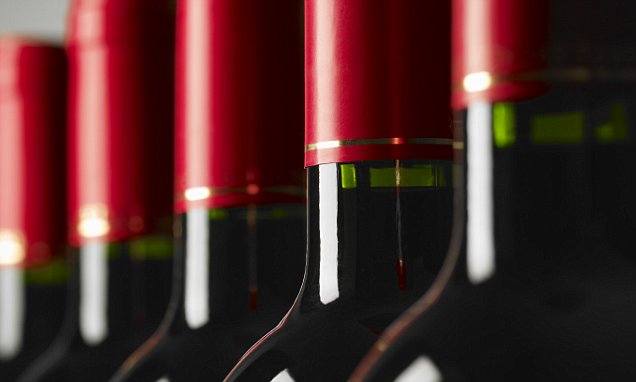
Find the location of a particular element. Image resolution: width=636 pixels, height=382 pixels. wine bottle is located at coordinates [30, 131], [99, 117], [217, 102], [354, 101], [494, 74].